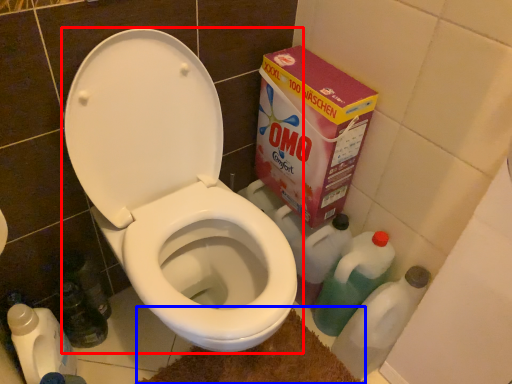
Question: Which object appears farthest to the camera in this image, toilet (highlighted by a red box) or bath mat (highlighted by a blue box)?

Choices:
 (A) toilet
 (B) bath mat

Answer: (B)